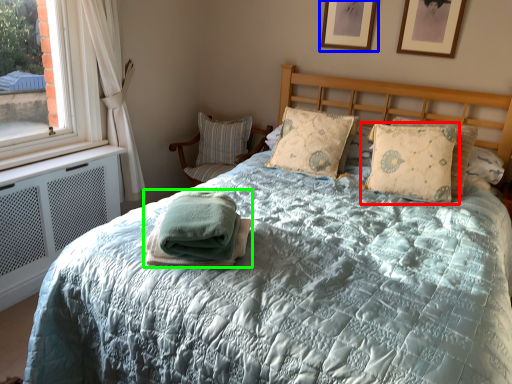
Question: Which is farther away from pillow (highlighted by a red box)? picture frame (highlighted by a blue box) or blanket (highlighted by a green box)?

Choices:
 (A) picture frame
 (B) blanket

Answer: (B)